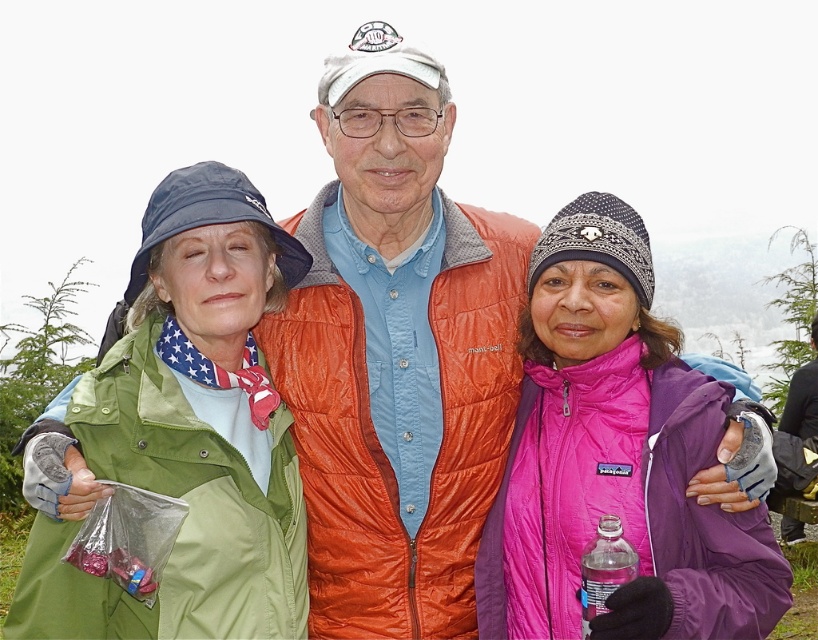
Question: Is green fabric jacket at left behind pink fleece jacket at center?

Choices:
 (A) yes
 (B) no

Answer: (A)

Question: Which of the following is the farthest from the observer?

Choices:
 (A) (596, 561)
 (B) (163, 458)
 (C) (767, 547)

Answer: (B)

Question: Can you confirm if pink fleece jacket at center is smaller than clear plastic bottle at lower right?

Choices:
 (A) no
 (B) yes

Answer: (A)

Question: Which object appears closest to the camera in this image?

Choices:
 (A) pink fleece jacket at center
 (B) green fabric jacket at left

Answer: (A)

Question: Is pink fleece jacket at center positioned at the back of clear plastic bottle at lower right?

Choices:
 (A) yes
 (B) no

Answer: (A)

Question: Which object appears farthest from the camera in this image?

Choices:
 (A) green fabric jacket at left
 (B) pink fleece jacket at center

Answer: (A)